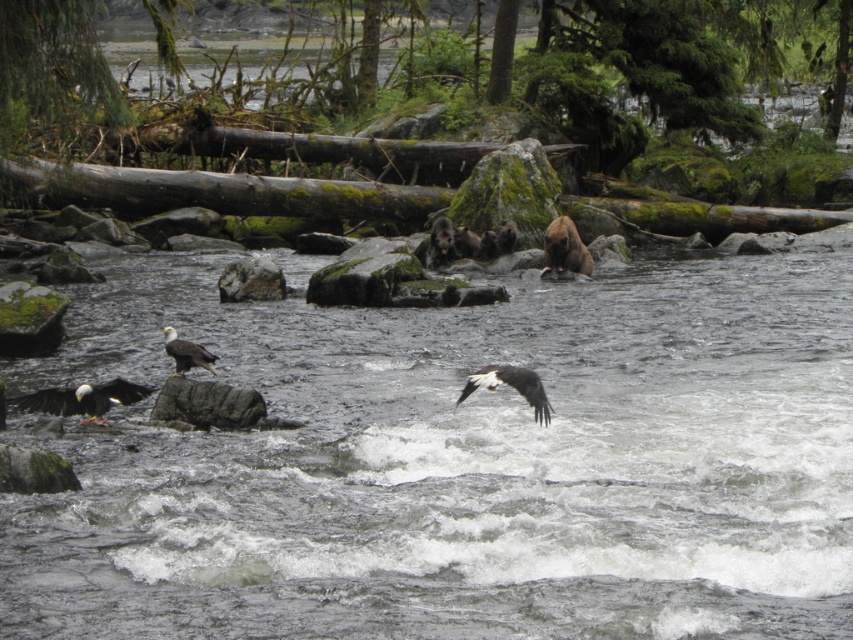
In the scene shown: Can you confirm if white-feathered bald eagle at lower left is positioned above brown furry bear at upper right?

Incorrect, white-feathered bald eagle at lower left is not positioned above brown furry bear at upper right.

Does point (126, 387) come farther from viewer compared to point (572, 257)?

No, it is in front of (572, 257).

Is point (18, 397) farther from viewer compared to point (579, 259)?

That is False.

I want to click on white-feathered bald eagle at lower left, so click(x=83, y=400).

Between point (44, 401) and point (190, 358), which one is positioned behind?

Point (190, 358)

Who is more distant from viewer, (67, 401) or (194, 365)?

Positioned behind is point (194, 365).

Locate an element on the screen. The image size is (853, 640). white-feathered bald eagle at lower left is located at coordinates (83, 400).

Is point (173, 394) positioned after point (137, 396)?

Yes.

Describe the element at coordinates (207, 403) in the screenshot. I see `gray rough rock at center` at that location.

Identify the location of gray rough rock at center. Image resolution: width=853 pixels, height=640 pixels. (207, 403).